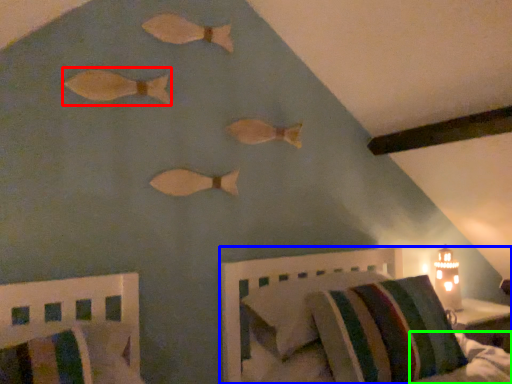
Question: Which is farther away from animal (highlighted by a red box)? furniture (highlighted by a blue box) or mattress (highlighted by a green box)?

Choices:
 (A) furniture
 (B) mattress

Answer: (B)